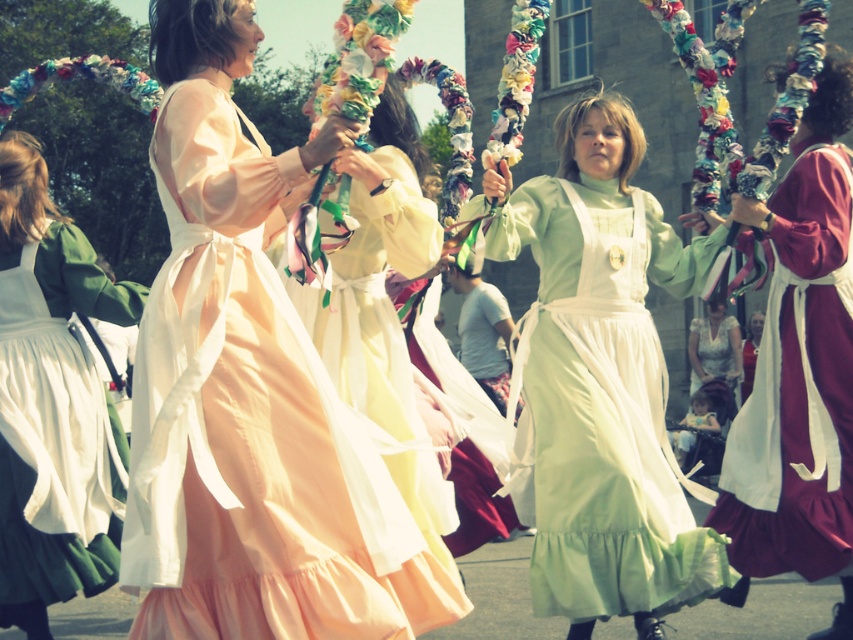
Question: Which of the following is the closest to the observer?

Choices:
 (A) 38,237
 (B) 730,211

Answer: (A)

Question: Which of the following is the farthest from the observer?

Choices:
 (A) light pink satin dress at center
 (B) green satin dress at left
 (C) velvet maroon dress at right
 (D) light green cotton dress at center

Answer: (C)

Question: Is light pink satin dress at center to the left of velvet maroon dress at right from the viewer's perspective?

Choices:
 (A) yes
 (B) no

Answer: (A)

Question: Does light green cotton dress at center appear over green satin dress at left?

Choices:
 (A) yes
 (B) no

Answer: (B)

Question: Is velvet maroon dress at right closer to camera compared to green satin dress at left?

Choices:
 (A) yes
 (B) no

Answer: (B)

Question: Which point is farther to the camera?

Choices:
 (A) light pink satin dress at center
 (B) light green cotton dress at center
 (C) green satin dress at left
 (D) velvet maroon dress at right

Answer: (D)